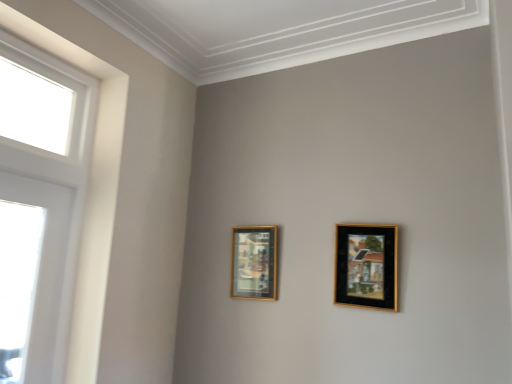
Question: From the image's perspective, does white glossy window at left appear higher than black matte picture frame at upper right, which is the first picture frame from front to back?

Choices:
 (A) yes
 (B) no

Answer: (A)

Question: Considering the relative sizes of white glossy window at left and black matte picture frame at upper right, the 2th picture frame viewed from the back, in the image provided, is white glossy window at left bigger than black matte picture frame at upper right, the 2th picture frame viewed from the back,?

Choices:
 (A) no
 (B) yes

Answer: (B)

Question: Is white glossy window at left aimed at black matte picture frame at upper right, the 1th picture frame when ordered from right to left?

Choices:
 (A) yes
 (B) no

Answer: (B)

Question: Considering the relative sizes of white glossy window at left and black matte picture frame at upper right, which is the first picture frame from front to back, in the image provided, is white glossy window at left taller than black matte picture frame at upper right, which is the first picture frame from front to back,?

Choices:
 (A) no
 (B) yes

Answer: (B)

Question: Is white glossy window at left far away from black matte picture frame at upper right, the 1th picture frame when ordered from right to left?

Choices:
 (A) yes
 (B) no

Answer: (B)

Question: Is white glossy window at left at the left side of black matte picture frame at upper right, the 1th picture frame when ordered from right to left?

Choices:
 (A) no
 (B) yes

Answer: (B)

Question: From a real-world perspective, does black matte picture frame at upper right, which is counted as the 2th picture frame, starting from the left, sit lower than gold-framed picture at center-left, which appears as the second picture frame when viewed from the right?

Choices:
 (A) yes
 (B) no

Answer: (B)

Question: Is black matte picture frame at upper right, the 1th picture frame when ordered from right to left, shorter than gold-framed picture at center-left, placed as the first picture frame when sorted from left to right?

Choices:
 (A) yes
 (B) no

Answer: (B)

Question: Is black matte picture frame at upper right, which is the first picture frame from front to back, beside gold-framed picture at center-left, placed as the first picture frame when sorted from left to right?

Choices:
 (A) yes
 (B) no

Answer: (B)

Question: Is black matte picture frame at upper right, which is the first picture frame from front to back, surrounding gold-framed picture at center-left, which appears as the second picture frame when viewed from the right?

Choices:
 (A) yes
 (B) no

Answer: (B)

Question: Can you confirm if black matte picture frame at upper right, which is the first picture frame from front to back, is wider than gold-framed picture at center-left, which is counted as the first picture frame, starting from the back?

Choices:
 (A) no
 (B) yes

Answer: (A)

Question: Is black matte picture frame at upper right, which is the first picture frame from front to back, looking in the opposite direction of gold-framed picture at center-left, which is counted as the first picture frame, starting from the back?

Choices:
 (A) yes
 (B) no

Answer: (B)

Question: From a real-world perspective, is gold-framed picture at center-left, the second picture frame in the front-to-back sequence, located beneath black matte picture frame at upper right, the 1th picture frame when ordered from right to left?

Choices:
 (A) no
 (B) yes

Answer: (B)